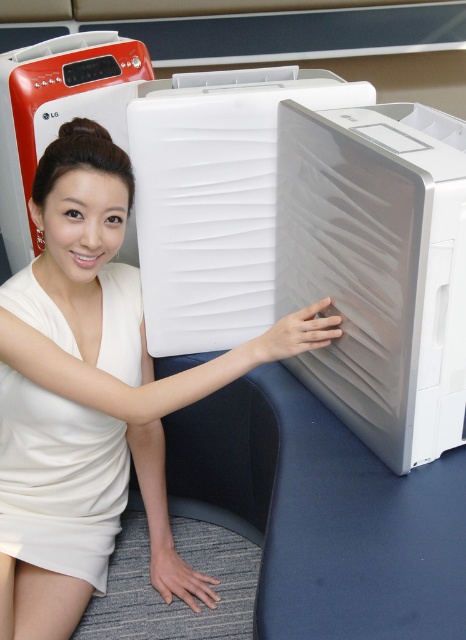
Can you confirm if white matte air purifier at center is positioned below white satin dress at center?

No, white matte air purifier at center is not below white satin dress at center.

Is point (158, 461) in front of point (114, 477)?

No, it is behind (114, 477).

Between point (145, 353) and point (83, 456), which one is positioned in front?

Point (83, 456) is more forward.

The width and height of the screenshot is (466, 640). Find the location of `white matte air purifier at center`. white matte air purifier at center is located at coordinates (137, 330).

From the picture: Is the position of satin white cooler at center less distant than that of white satin dress at center?

Yes.

Does point (292, 193) lie behind point (54, 308)?

No, it is in front of (54, 308).

The width and height of the screenshot is (466, 640). In order to click on satin white cooler at center in this screenshot , I will do `click(378, 269)`.

Does satin white cooler at center appear over white matte air purifier at center?

Yes, satin white cooler at center is above white matte air purifier at center.

Between satin white cooler at center and white matte air purifier at center, which one has more height?

white matte air purifier at center is taller.

Which is in front, point (279, 301) or point (89, 230)?

Point (89, 230) is more forward.

The height and width of the screenshot is (640, 466). Find the location of `satin white cooler at center`. satin white cooler at center is located at coordinates (378, 269).